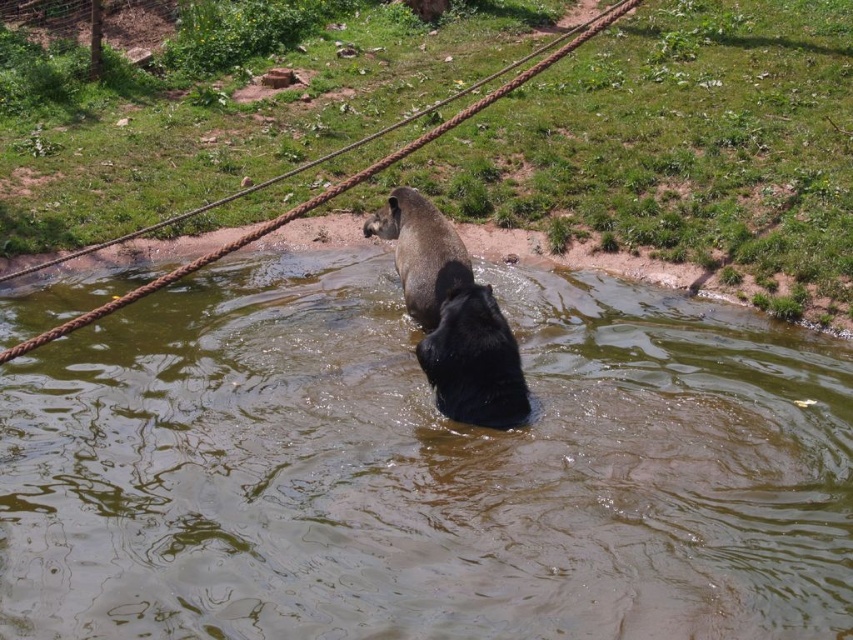
You are a zookeeper observing the animals in the enclosure. You notice the brown fur dog at center and the brown murky water at center. Which object is positioned lower in the scene?

The brown murky water at center is located below the brown fur dog at center, so it is positioned lower in the scene.

You are observing the scene from the edge of the enclosure. There is a dark animal partially submerged in the water and a larger animal behind it. Where exactly is the brown murky water at center located in terms of coordinates?

The brown murky water at center is located at coordinates point (422, 468).